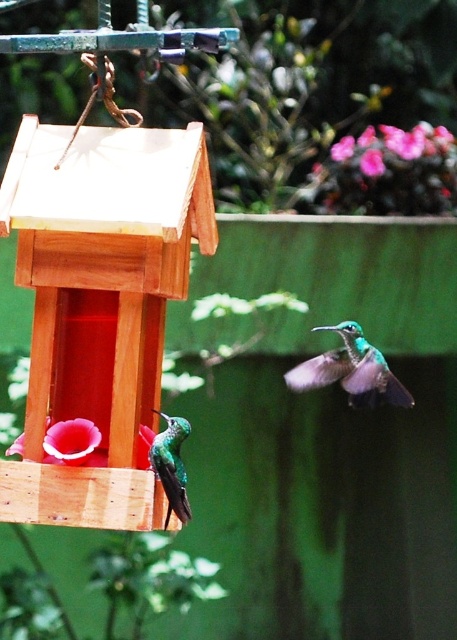
You are a photographer trying to capture the green iridescent hummingbird at lower left. Based on the coordinates provided, where should you position your camera to ensure the hummingbird is centered in your shot?

The green iridescent hummingbird at lower left is located at coordinates point (171, 465). To center it in your shot, position your camera so that the crosshairs align with these coordinates.

You are a small insect trying to reach the nectar from the pink matte flower at lower left and the pink matte flower at upper center. Which flower is closer to the ground?

The pink matte flower at lower left is shorter than the pink matte flower at upper center, so it is closer to the ground.

Consider the image. What are the coordinates of the green iridescent hummingbird at lower left in the image?

The green iridescent hummingbird at lower left is located at coordinates point (171,465).